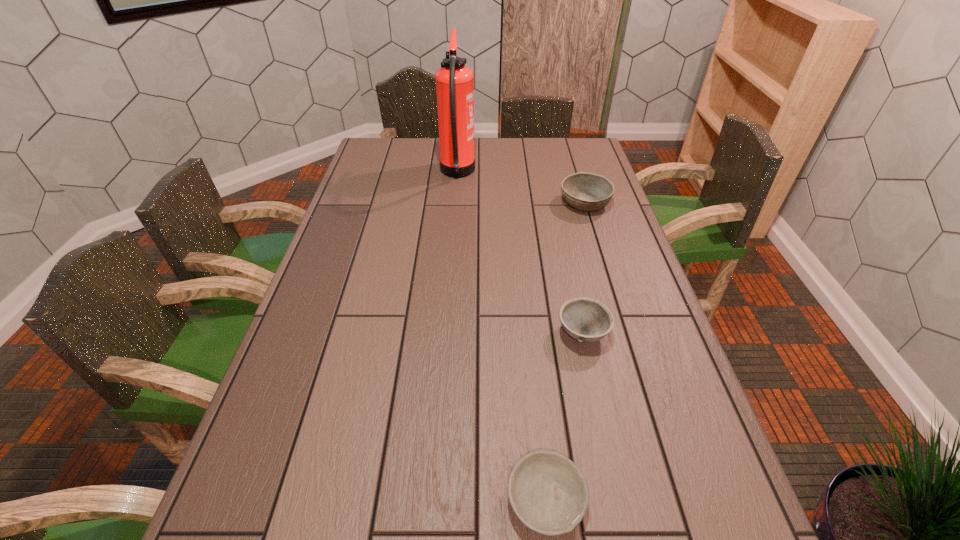
Where is `fire extinguisher`? The image size is (960, 540). fire extinguisher is located at coordinates (454, 82).

The image size is (960, 540). In order to click on the tallest object in this screenshot , I will do `click(454, 82)`.

You are a GUI agent. You are given a task and a screenshot of the screen. Output one action in this format:
    pyautogui.click(x=<x>, y=<y>)
    Task: Click on the farthest bowl
    The image size is (960, 540).
    Given the screenshot: What is the action you would take?
    pyautogui.click(x=588, y=192)

Find the location of a particular element. Image resolution: width=960 pixels, height=540 pixels. the second nearest object is located at coordinates (585, 319).

Identify the location of free space located 0.070m at the nozzle of the leftmost object. tap(493, 174).

Find the location of a particular element. vacant area located 0.290m on the front of the farthest bowl is located at coordinates click(608, 279).

Identify the location of vacant space located on the back of the second farthest bowl. (572, 287).

Identify the location of object positioned at the far edge. This screenshot has height=540, width=960. (454, 82).

In the image, there is a desktop. Where is `free space at the far edge`? The width and height of the screenshot is (960, 540). free space at the far edge is located at coordinates (513, 158).

In the image, there is a desktop. Where is `vacant space at the left edge`? vacant space at the left edge is located at coordinates [x=217, y=528].